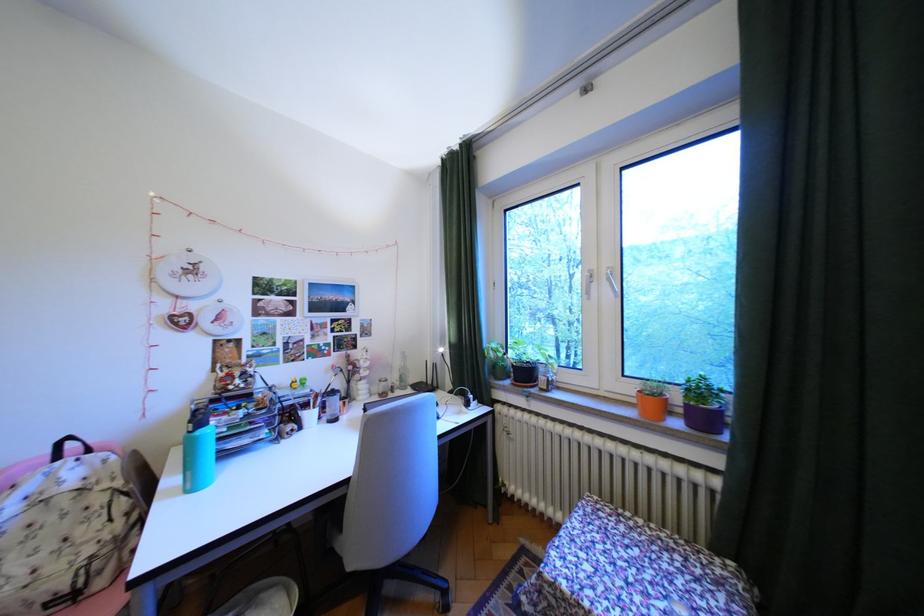
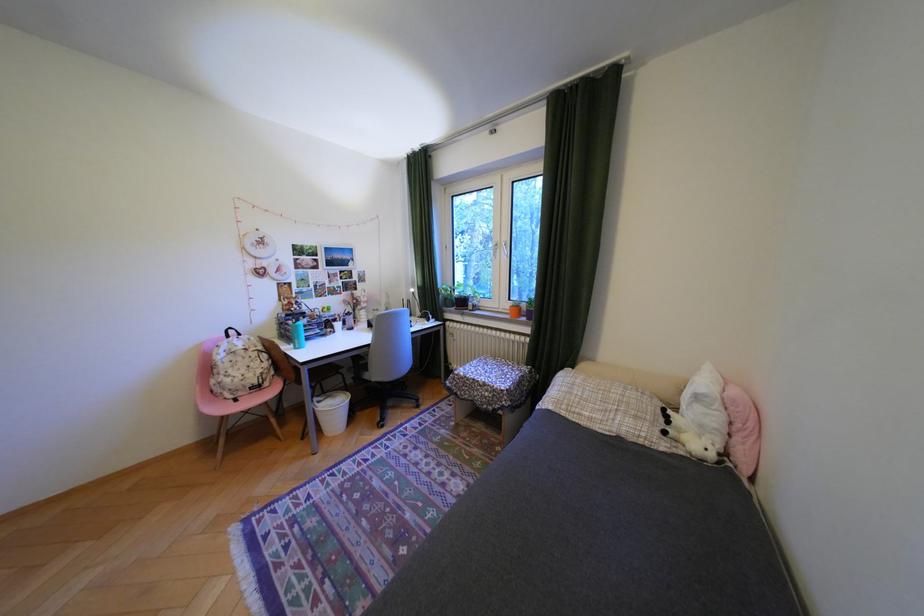
Where in the second image is the point corresponding to (x=537, y=375) from the first image?

(475, 302)